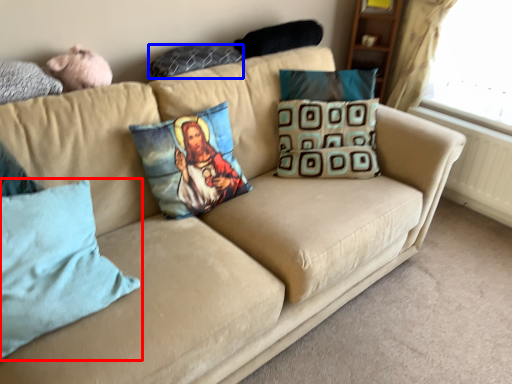
Question: Among these objects, which one is nearest to the camera, pillow (highlighted by a red box) or pillow (highlighted by a blue box)?

Choices:
 (A) pillow
 (B) pillow

Answer: (A)